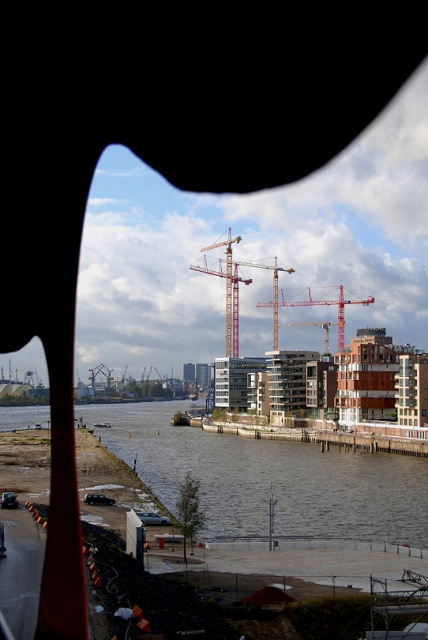
Question: Considering the real-world distances, which object is closest to the brown concrete river at lower center?

Choices:
 (A) metallic construction crane at center
 (B) red metal crane at center

Answer: (A)

Question: Is metallic construction crane at center thinner than red metal crane at center?

Choices:
 (A) yes
 (B) no

Answer: (B)

Question: Can you confirm if brown concrete river at lower center is positioned below metallic construction crane at center?

Choices:
 (A) yes
 (B) no

Answer: (A)

Question: Does metallic construction crane at center have a lesser width compared to red metal crane at center?

Choices:
 (A) no
 (B) yes

Answer: (A)

Question: Which point appears closest to the camera in this image?

Choices:
 (A) (363, 492)
 (B) (326, 346)
 (C) (231, 260)

Answer: (A)

Question: Which point is farther to the camera?

Choices:
 (A) brown concrete river at lower center
 (B) red metal crane at center
 (C) metallic construction crane at center

Answer: (C)